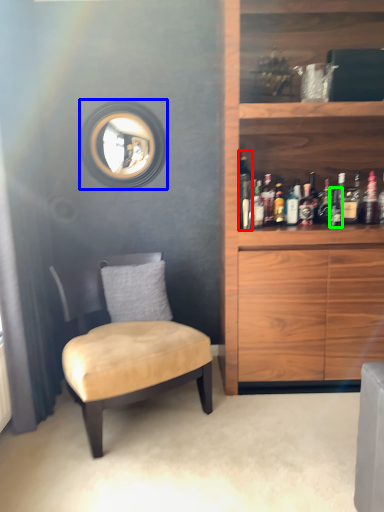
Question: Which object is positioned farthest from bottle (highlighted by a red box)? Select from mirror (highlighted by a blue box) and bottle (highlighted by a green box).

Choices:
 (A) mirror
 (B) bottle

Answer: (A)